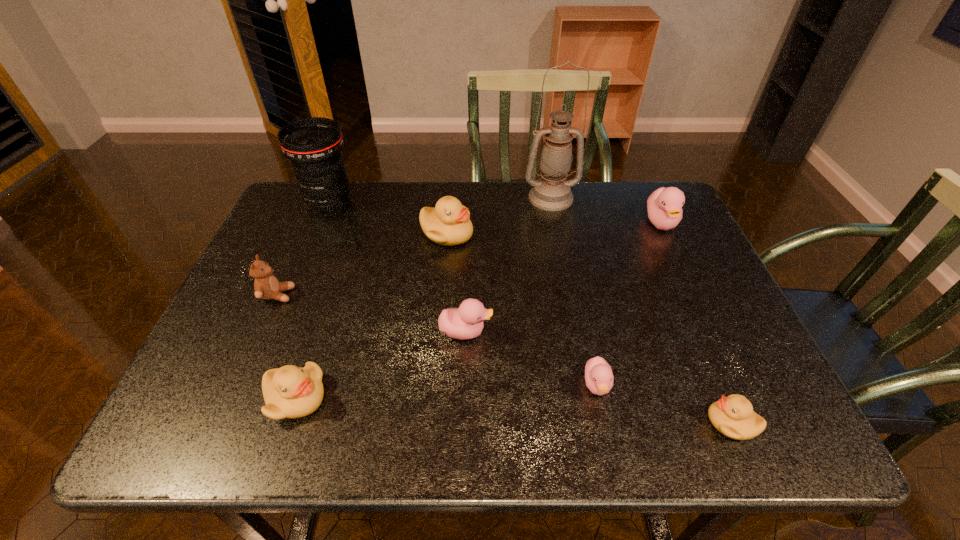
Locate an element on the screen. Image resolution: width=960 pixels, height=540 pixels. vacant space that's between the smallest yellow duckling and the biggest yellow duckling is located at coordinates point(589,328).

Find the location of `free point between the teddy bear and the farthest pink duckling`. free point between the teddy bear and the farthest pink duckling is located at coordinates (469, 259).

What are the coordinates of `free spot between the brown teddy bear and the eighth shortest object` in the screenshot? It's located at (303, 248).

The height and width of the screenshot is (540, 960). Identify the location of free spot between the fourth nearest duckling and the leftmost yellow duckling. 381,365.

Locate an element on the screen. vacant area that lies between the oil lamp and the third duckling from right to left is located at coordinates (574, 292).

I want to click on free space between the tallest object and the rightmost pink duckling, so click(606, 211).

The image size is (960, 540). I want to click on vacant region between the smallest yellow duckling and the farthest pink duckling, so click(696, 323).

Find the location of a particular element. Image resolution: width=960 pixels, height=540 pixels. free area in between the oil lamp and the farthest yellow duckling is located at coordinates (499, 216).

I want to click on free area in between the fourth nearest duckling and the farthest pink duckling, so click(x=564, y=278).

Locate which object ranks third in proximity to the leftmost pink duckling. Please provide its 2D coordinates. Your answer should be formatted as a tuple, i.e. [(x, y)], where the tuple contains the x and y coordinates of a point satisfying the conditions above.

[(449, 223)]